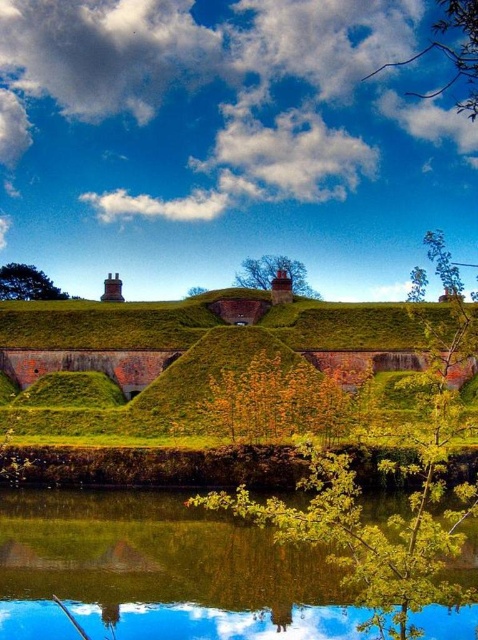
Question: Which point is farther to the camera?

Choices:
 (A) green leafy tree at upper left
 (B) green reflective water at lower center

Answer: (A)

Question: Considering the relative positions of green reflective water at lower center and green leafy tree at center in the image provided, where is green reflective water at lower center located with respect to green leafy tree at center?

Choices:
 (A) above
 (B) below

Answer: (B)

Question: Which is nearer to the green leafy tree at center?

Choices:
 (A) green grassy hillside at center
 (B) green leafy tree at upper left

Answer: (A)

Question: Can you confirm if green leafy tree at upper right is positioned below green leafy tree at upper left?

Choices:
 (A) yes
 (B) no

Answer: (B)

Question: Which is farther from the green grassy hillside at center?

Choices:
 (A) green reflective water at lower center
 (B) green leafy tree at center

Answer: (B)

Question: Is green reflective water at lower center positioned before green leafy tree at upper left?

Choices:
 (A) no
 (B) yes

Answer: (B)